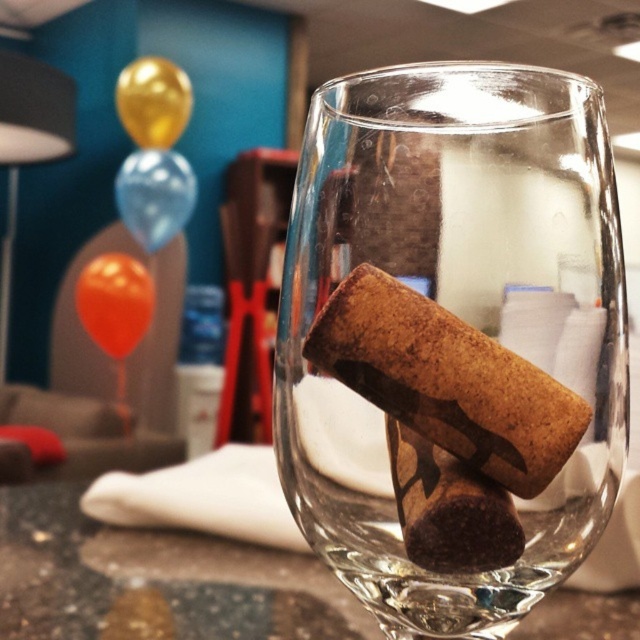
Question: Is translucent glass table at center to the right of brown/cork-like at center from the viewer's perspective?

Choices:
 (A) yes
 (B) no

Answer: (B)

Question: Can you confirm if translucent glass table at center is positioned to the right of orange matte balloon at upper left?

Choices:
 (A) no
 (B) yes

Answer: (B)

Question: Which point is farther from the camera taking this photo?

Choices:
 (A) (100, 342)
 (B) (560, 442)

Answer: (A)

Question: Among these objects, which one is nearest to the camera?

Choices:
 (A) brown matte cork at center
 (B) brown/cork-like at center
 (C) gold metallic balloon at upper left

Answer: (B)

Question: Which of the following is the farthest from the observer?

Choices:
 (A) brown/cork-like at center
 (B) orange matte balloon at upper left

Answer: (B)

Question: Does brown matte cork at center lie in front of orange matte balloon at upper left?

Choices:
 (A) yes
 (B) no

Answer: (A)